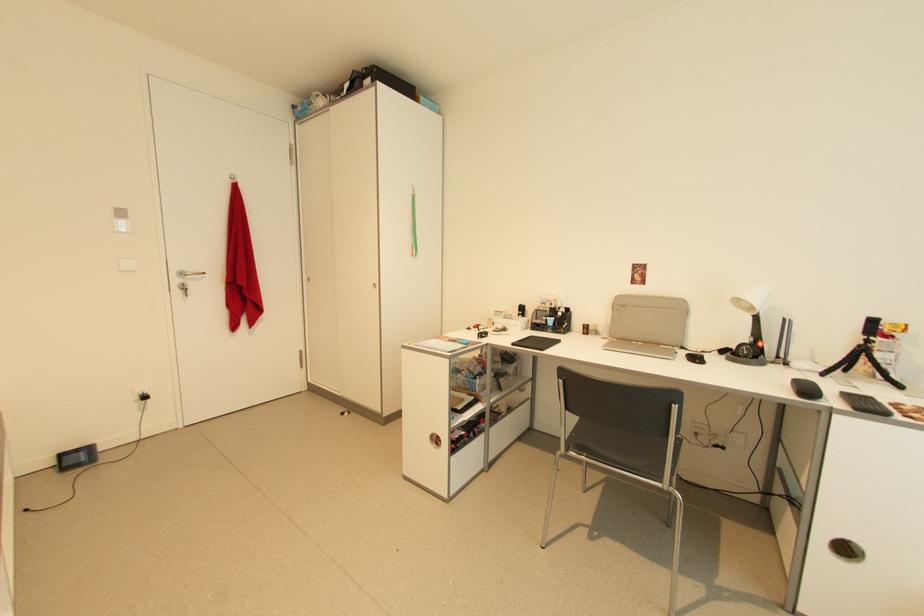
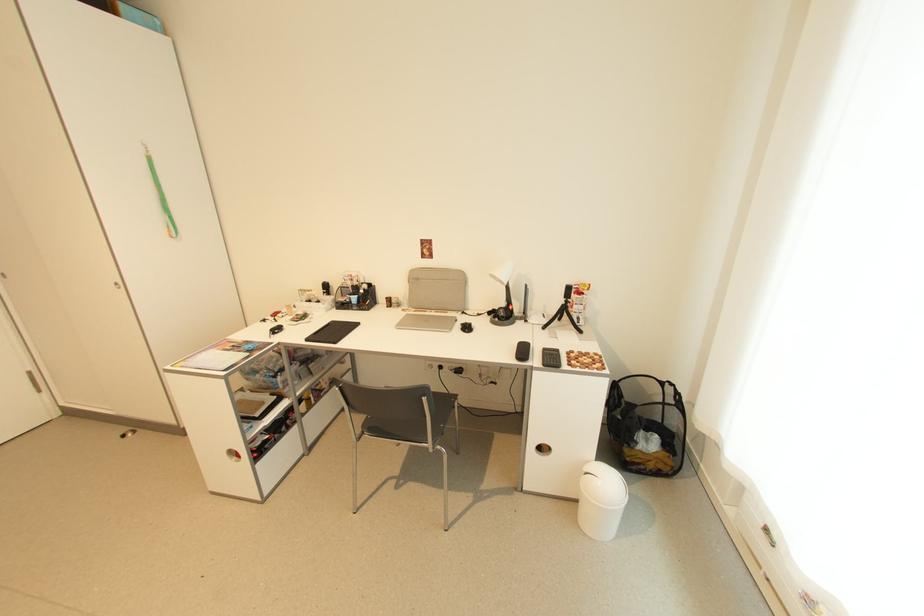
Locate, in the second image, the point that corresponds to point 752,342 in the first image.

(507, 306)